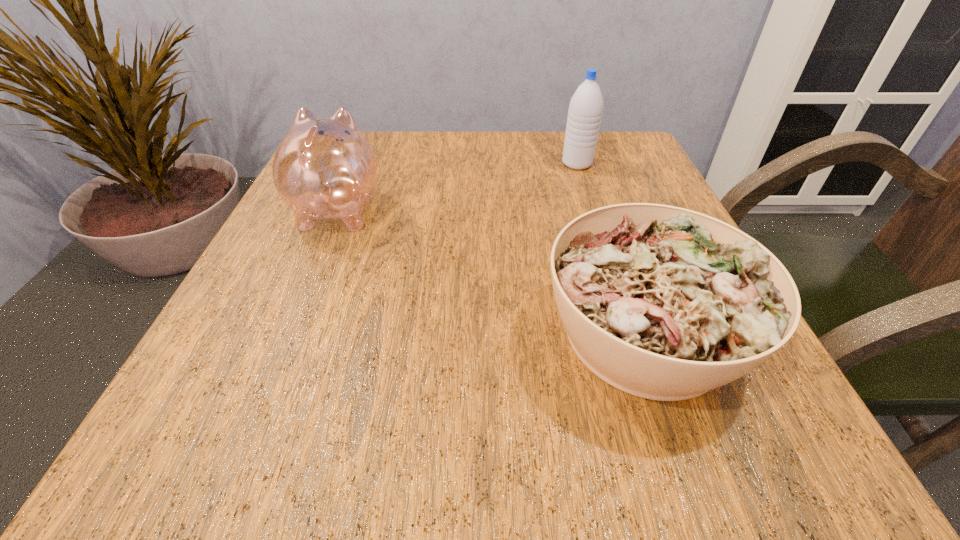
At what (x,y) coordinates should I click in order to perform the action: click on vacant space at the left edge of the desktop. Please return your answer as a coordinate pair (x, y). Image resolution: width=960 pixels, height=540 pixels. Looking at the image, I should click on (275, 263).

You are a GUI agent. You are given a task and a screenshot of the screen. Output one action in this format:
    pyautogui.click(x=<x>, y=<y>)
    Task: Click on the vacant space at the right edge
    The width and height of the screenshot is (960, 540).
    Given the screenshot: What is the action you would take?
    pyautogui.click(x=661, y=191)

Find the location of `free space at the far left corner of the desktop`. free space at the far left corner of the desktop is located at coordinates (379, 163).

The height and width of the screenshot is (540, 960). In order to click on blank space at the near right corner of the desktop in this screenshot , I will do `click(732, 464)`.

Where is `vacant space in between the water bottle and the leftmost object`? This screenshot has width=960, height=540. vacant space in between the water bottle and the leftmost object is located at coordinates 457,186.

Identify the location of free space that is in between the shortest object and the leftmost object. The height and width of the screenshot is (540, 960). (492, 271).

I want to click on free space between the leftmost object and the farthest object, so click(x=457, y=186).

The image size is (960, 540). I want to click on free spot between the piggy bank and the salad, so click(492, 271).

You are a GUI agent. You are given a task and a screenshot of the screen. Output one action in this format:
    pyautogui.click(x=<x>, y=<y>)
    Task: Click on the free area in between the water bottle and the second farthest object
    
    Given the screenshot: What is the action you would take?
    pyautogui.click(x=457, y=186)

This screenshot has width=960, height=540. I want to click on vacant space that is in between the salad and the piggy bank, so click(x=492, y=271).